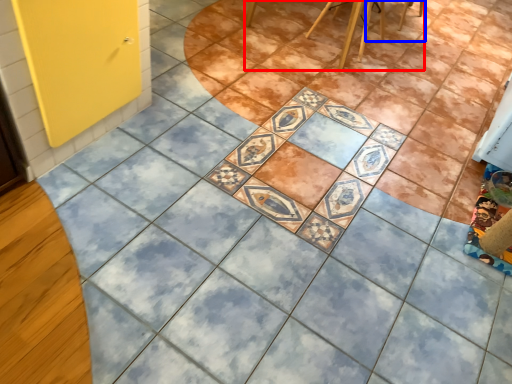
Question: Which point is closer to the camera, furniture (highlighted by a red box) or chair (highlighted by a blue box)?

Choices:
 (A) furniture
 (B) chair

Answer: (A)